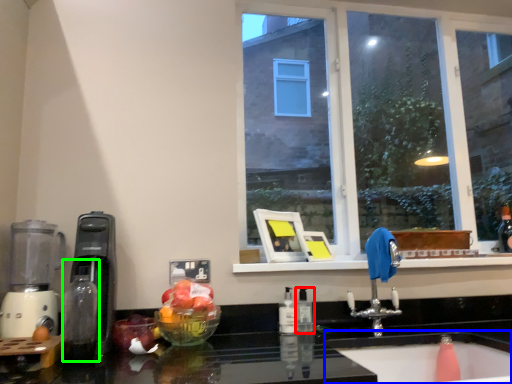
Question: Which is nearer to the bottle (highlighted by a red box)? sink (highlighted by a blue box) or bottle (highlighted by a green box).

Choices:
 (A) sink
 (B) bottle

Answer: (A)